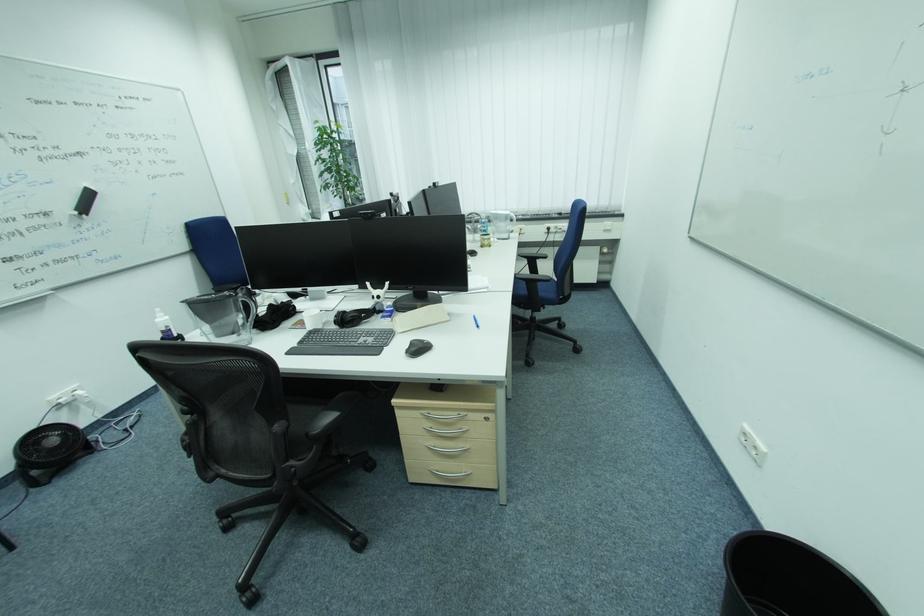
Locate an element on the screen. water pitcher handle is located at coordinates (246, 305).